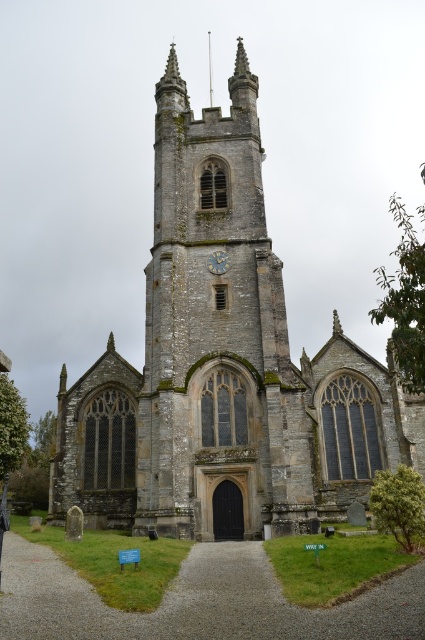
Question: Among these points, which one is farthest from the camera?

Choices:
 (A) (246, 344)
 (B) (223, 262)

Answer: (B)

Question: Is stone church at center bigger than gold textured clock at center?

Choices:
 (A) yes
 (B) no

Answer: (A)

Question: Is stone church at center to the right of gold textured clock at center from the viewer's perspective?

Choices:
 (A) yes
 (B) no

Answer: (B)

Question: Among these objects, which one is nearest to the camera?

Choices:
 (A) gold textured clock at center
 (B) stone church at center

Answer: (B)

Question: Is stone church at center positioned at the back of gold textured clock at center?

Choices:
 (A) yes
 (B) no

Answer: (B)